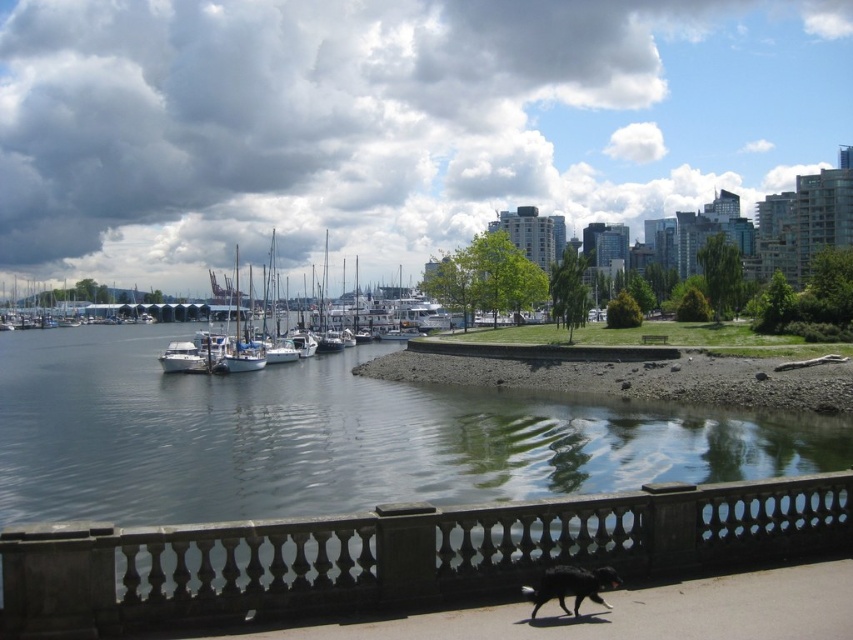
You are a photographer standing on the paved pathway at the waterfront. You want to take a photo of the black fur dog at lower center while ensuring the dark gray stone railing at lower center doesn t block the view. Is the railing low enough for you to avoid obstruction?

The dark gray stone railing at lower center is shorter than the black fur dog at lower center, so the railing is low enough to avoid blocking the view of the dog.

You are standing at the edge of the waterfront pathway and want to find the dark gray stone railing at lower center. According to the scene description, where should you look relative to your position?

The dark gray stone railing at lower center is located at point (399, 556), so you should look towards the lower center area of the scene to find it.